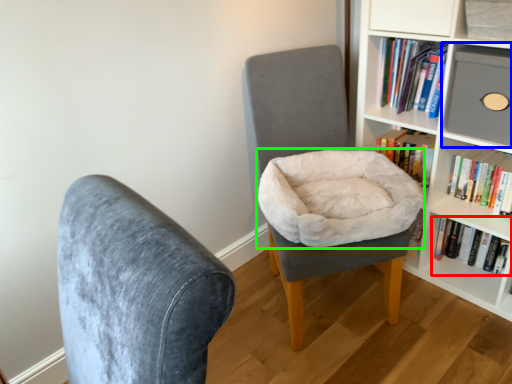
Question: Which object is the farthest from book (highlighted by a red box)? Choose among these: shelf (highlighted by a blue box) or bean bag chair (highlighted by a green box).

Choices:
 (A) shelf
 (B) bean bag chair

Answer: (B)